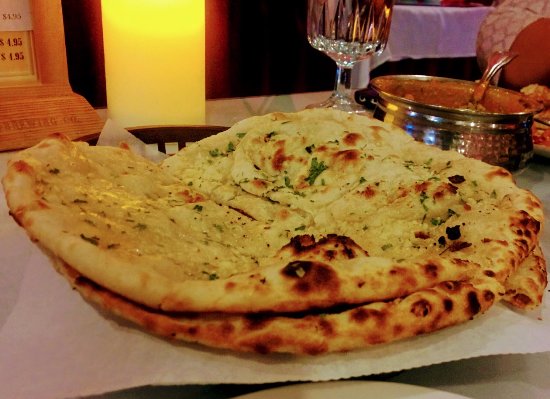
You are a GUI agent. You are given a task and a screenshot of the screen. Output one action in this format:
    pyautogui.click(x=<x>, y=<y>)
    Task: Click on the pot
    The image size is (550, 399).
    Given the screenshot: What is the action you would take?
    pyautogui.click(x=464, y=123)